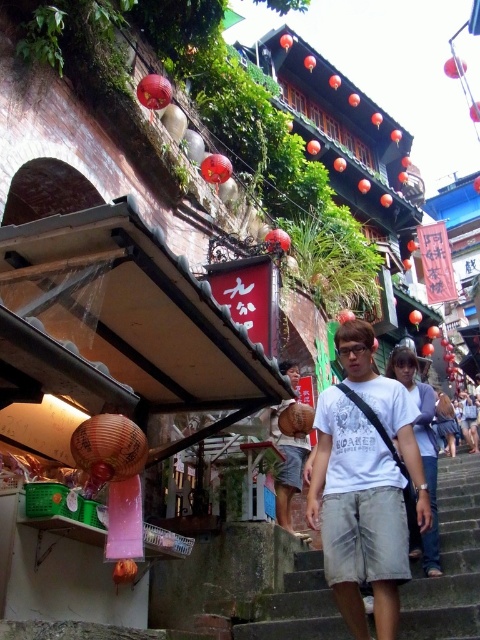
Who is lower down, gray concrete stairs at center or matte brown woven basket at center?

gray concrete stairs at center is below.

Is point (408, 586) farther from camera compared to point (298, 378)?

No.

The height and width of the screenshot is (640, 480). Find the location of `gray concrete stairs at center`. gray concrete stairs at center is located at coordinates (448, 561).

Between white cotton t-shirt at center and gray concrete stairs at center, which one appears on the right side from the viewer's perspective?

gray concrete stairs at center is more to the right.

Measure the distance between point (408, 556) and camera.

22.27 meters

Between point (368, 381) and point (285, 611), which one is positioned in front?

Positioned in front is point (285, 611).

Identify the location of white cotton t-shirt at center. This screenshot has height=640, width=480. coord(364,484).

Between white cotton t-shirt at center and matte brown woven basket at center, which one has more height?

white cotton t-shirt at center is taller.

Is white cotton t-shirt at center bigger than matte brown woven basket at center?

Actually, white cotton t-shirt at center might be smaller than matte brown woven basket at center.

The image size is (480, 640). I want to click on white cotton t-shirt at center, so click(x=364, y=484).